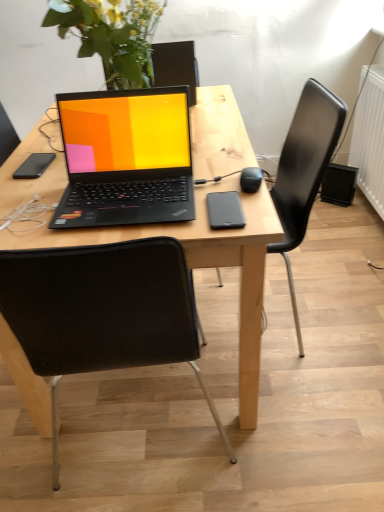
Locate an element on the screen. unoccupied space behind black matte phone at center, the 2th mobile phone in the left-to-right sequence is located at coordinates (213, 176).